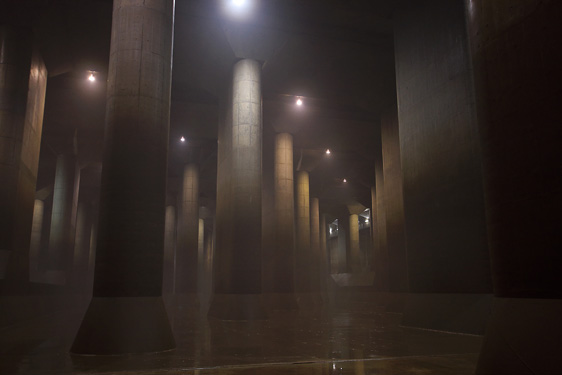
The width and height of the screenshot is (562, 375). Find the location of `light bulbs`. light bulbs is located at coordinates (235, 0), (300, 103), (92, 80), (184, 142), (328, 151), (344, 181).